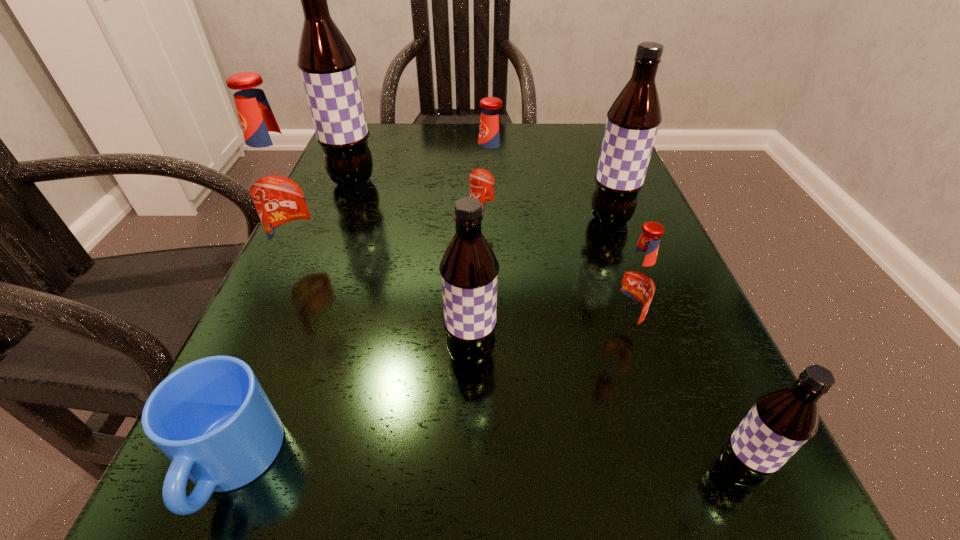
Locate an element on the screen. This screenshot has width=960, height=540. the smallest red root beer is located at coordinates click(x=635, y=285).

Image resolution: width=960 pixels, height=540 pixels. I want to click on the nearest root beer, so click(x=783, y=419).

The height and width of the screenshot is (540, 960). I want to click on the smallest brown root beer, so click(x=783, y=419).

Where is `mug`? This screenshot has width=960, height=540. mug is located at coordinates (211, 418).

Identify the location of free spot located 0.360m on the right of the biggest brown root beer. (550, 181).

This screenshot has height=540, width=960. Identify the location of vacant space located 0.140m on the back of the second biggest brown root beer. (591, 170).

The height and width of the screenshot is (540, 960). What are the coordinates of `vacant space located on the back of the fourth farthest object` in the screenshot? It's located at (348, 166).

Identify the location of vacant space located on the front of the farthest red root beer. This screenshot has width=960, height=540. (x=492, y=391).

In order to click on free location located 0.130m on the left of the second nearest brown root beer in this screenshot , I will do `click(349, 354)`.

I want to click on vacant position located 0.180m on the front of the nearest red root beer, so click(x=665, y=474).